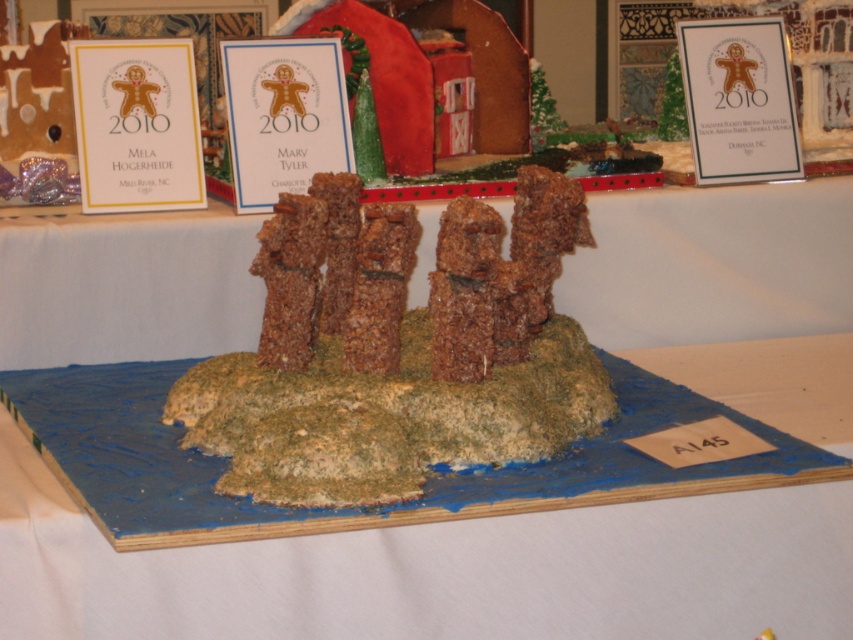
Question: Which object is closer to the camera taking this photo?

Choices:
 (A) blue paperboard at center
 (B) brown textured rice krispies treat at center
 (C) brown crumbly cake at center

Answer: (A)

Question: Is brown crumbly cake at center below brown textured rice krispies treat at center?

Choices:
 (A) yes
 (B) no

Answer: (A)

Question: Estimate the real-world distances between objects in this image. Which object is farther from the brown textured rice krispies treat at center?

Choices:
 (A) brown crumbly cake at center
 (B) blue paperboard at center

Answer: (B)

Question: Observing the image, what is the correct spatial positioning of brown crumbly cake at center in reference to brown textured rice krispies treat at center?

Choices:
 (A) above
 (B) below

Answer: (B)

Question: Estimate the real-world distances between objects in this image. Which object is farther from the brown crumbly cake at center?

Choices:
 (A) blue paperboard at center
 (B) brown textured rice krispies treat at center

Answer: (B)

Question: Is blue paperboard at center wider than brown crumbly cake at center?

Choices:
 (A) no
 (B) yes

Answer: (B)